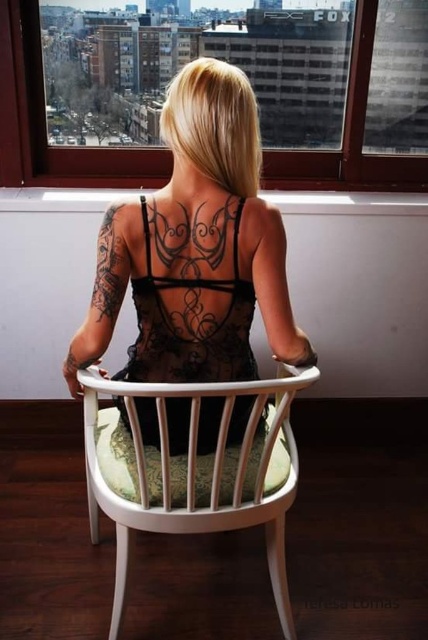
Which is more to the left, black lace tattoo at upper center or black ink tattoo at upper left?

black ink tattoo at upper left

Does point (234, 220) lie in front of point (92, 310)?

Yes, it is in front of point (92, 310).

Is point (131, 220) behind point (119, 227)?

Yes, it is behind point (119, 227).

At what (x,y) coordinates should I click in order to perform the action: click on black lace tattoo at upper center. Please return your answer as a coordinate pair (x, y). Looking at the image, I should click on (208, 243).

Is black lace tattoo at upper center wider than transparent glass window at upper center?

Correct, the width of black lace tattoo at upper center exceeds that of transparent glass window at upper center.

Identify the location of black lace tattoo at upper center. 208,243.

At what (x,y) coordinates should I click in order to perform the action: click on black lace tattoo at upper center. Please return your answer as a coordinate pair (x, y). This screenshot has width=428, height=640. Looking at the image, I should click on (208, 243).

How much distance is there between black lace tattoo at upper center and white wood chair at center?

A distance of 8.42 inches exists between black lace tattoo at upper center and white wood chair at center.

You are a GUI agent. You are given a task and a screenshot of the screen. Output one action in this format:
    pyautogui.click(x=<x>, y=<y>)
    Task: Click on the black lace tattoo at upper center
    
    Given the screenshot: What is the action you would take?
    pyautogui.click(x=208, y=243)

Measure the distance between black lace tattoo at upper center and camera.

The distance of black lace tattoo at upper center from camera is 4.00 feet.

Where is `black lace tattoo at upper center`? black lace tattoo at upper center is located at coordinates (208, 243).